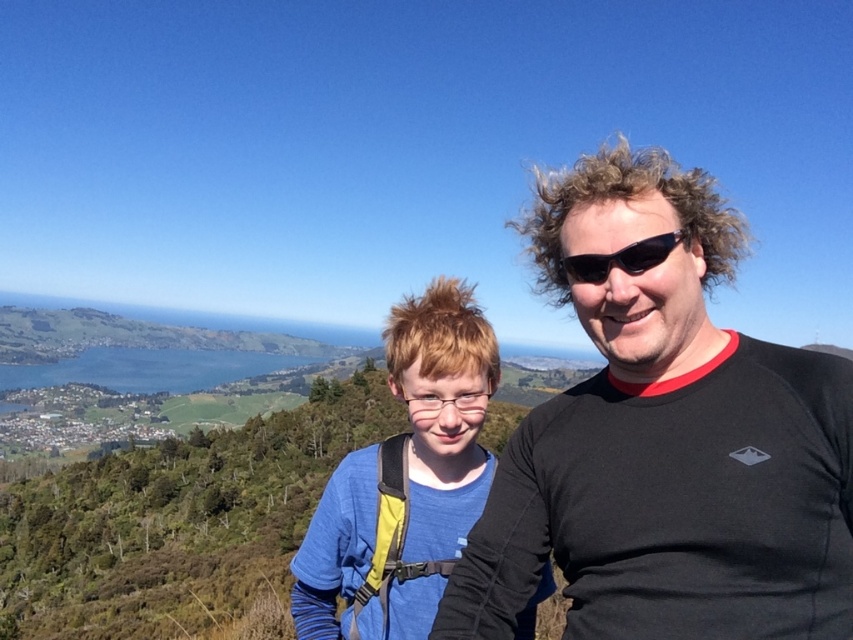
Question: Does black matte shirt at right appear on the right side of blue fabric shirt at center?

Choices:
 (A) yes
 (B) no

Answer: (A)

Question: Which object appears closest to the camera in this image?

Choices:
 (A) blue fabric shirt at center
 (B) black plastic sunglasses at center
 (C) black matte shirt at right

Answer: (C)

Question: Does blue fabric shirt at center have a greater width compared to black plastic sunglasses at center?

Choices:
 (A) no
 (B) yes

Answer: (B)

Question: Among these points, which one is farthest from the camera?

Choices:
 (A) (514, 513)
 (B) (538, 588)

Answer: (B)

Question: Is black matte shirt at right closer to the viewer compared to black plastic sunglasses at center?

Choices:
 (A) no
 (B) yes

Answer: (B)

Question: Which point appears farthest from the camera in this image?

Choices:
 (A) (579, 592)
 (B) (436, 426)

Answer: (B)